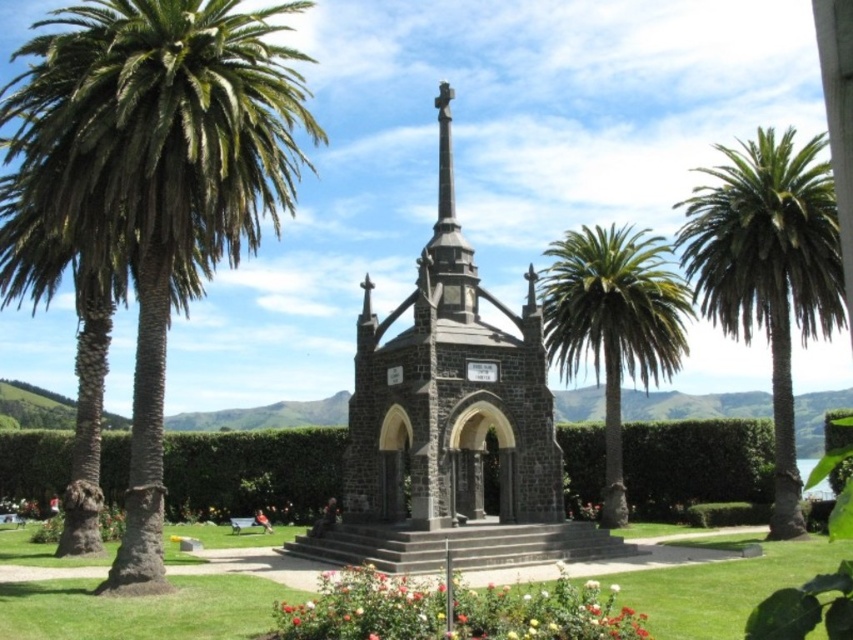
Question: Which point is farther to the camera?

Choices:
 (A) white matte flower at center
 (B) green hedge at center
 (C) dark gray stone church at center

Answer: (B)

Question: Which point is closer to the camera taking this photo?

Choices:
 (A) (163, 273)
 (B) (613, 592)
 (C) (728, 454)

Answer: (B)

Question: Which object is closer to the camera taking this photo?

Choices:
 (A) dark gray stone church at center
 (B) green leafy hedge at center
 (C) green leafy palm at left
 (D) green hedge at center

Answer: (C)

Question: In this image, where is multicolored petals at lower center located relative to green leafy hedge at center?

Choices:
 (A) below
 (B) above

Answer: (A)

Question: Does dark gray stone church at center appear under green leafy palm tree at right?

Choices:
 (A) yes
 (B) no

Answer: (A)

Question: Can you confirm if dark gray stone church at center is positioned to the left of green leafy palm tree at center?

Choices:
 (A) yes
 (B) no

Answer: (A)